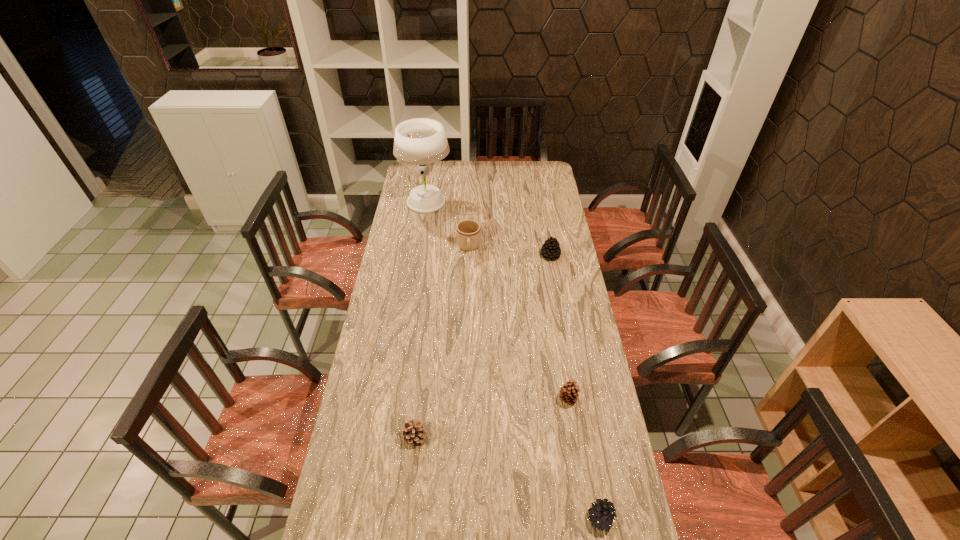
Identify which object is the fourth closest to the fourth farthest object. Please provide its 2D coordinates. Your answer should be formatted as a tuple, i.e. [(x, y)], where the tuple contains the x and y coordinates of a point satisfying the conditions above.

[(468, 231)]

This screenshot has width=960, height=540. In order to click on pinecone object that ranks as the fourth closest to the lamp in this screenshot , I will do `click(602, 514)`.

Where is `the second closest pinecone to the farthest object`? Image resolution: width=960 pixels, height=540 pixels. the second closest pinecone to the farthest object is located at coordinates (569, 392).

This screenshot has height=540, width=960. In order to click on blank space that satisfies the following two spatial constraints: 1. on the side of the third object from left to right with the handle; 2. on the right side of the nearest object in this screenshot , I will do `click(461, 518)`.

This screenshot has width=960, height=540. What are the coordinates of `free spot that satisfies the following two spatial constraints: 1. at the narrow end of the nearest object; 2. on the left side of the farthest pinecone` in the screenshot? It's located at (596, 518).

Find the location of a particular element. This screenshot has width=960, height=540. vacant region that satisfies the following two spatial constraints: 1. at the narrow end of the farthest pinecone; 2. on the front side of the third nearest object is located at coordinates (575, 399).

Image resolution: width=960 pixels, height=540 pixels. I want to click on free spot that satisfies the following two spatial constraints: 1. on the front-facing side of the third nearest pinecone; 2. on the left side of the farthest object, so click(396, 399).